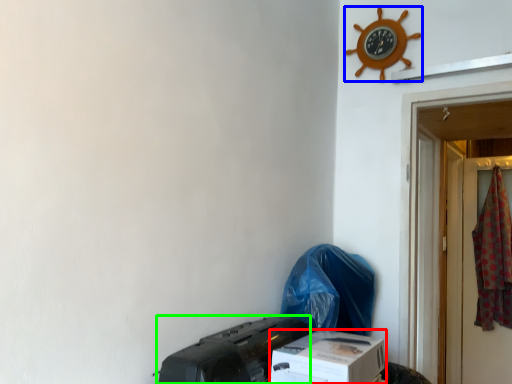
Question: Considering the real-world distances, which object is farthest from box (highlighted by a red box)? clock (highlighted by a blue box) or printer (highlighted by a green box)?

Choices:
 (A) clock
 (B) printer

Answer: (A)